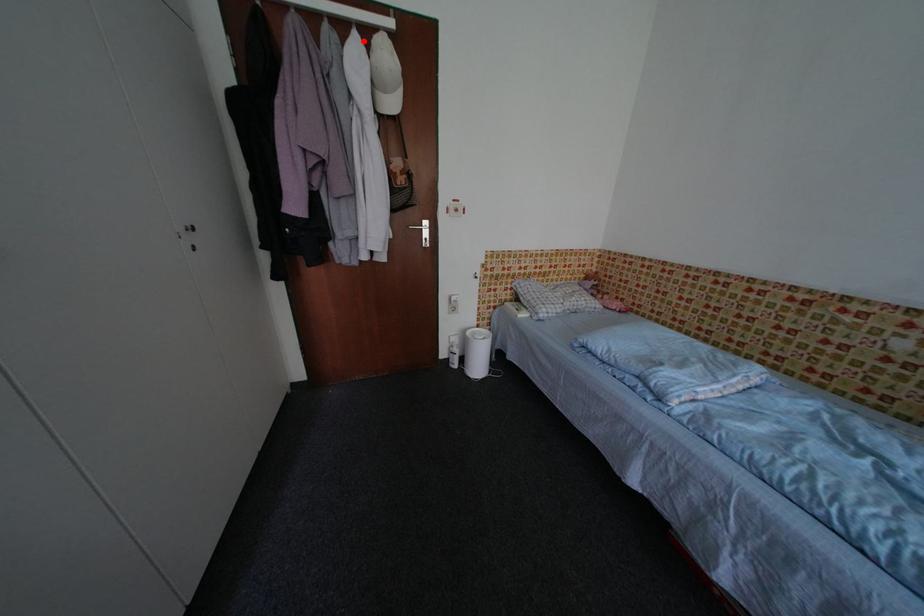
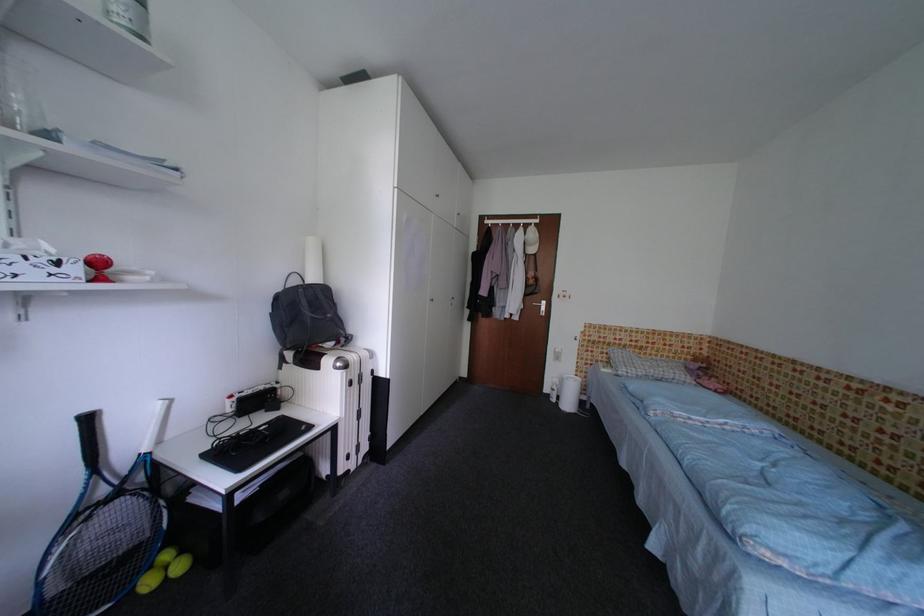
Question: I am providing you with two images of the same scene from different viewpoints. Given a red point in image1, look at the same physical point in image2. Is it:

Choices:
 (A) Closer to the viewpoint
 (B) Farther from the viewpoint

Answer: (A)